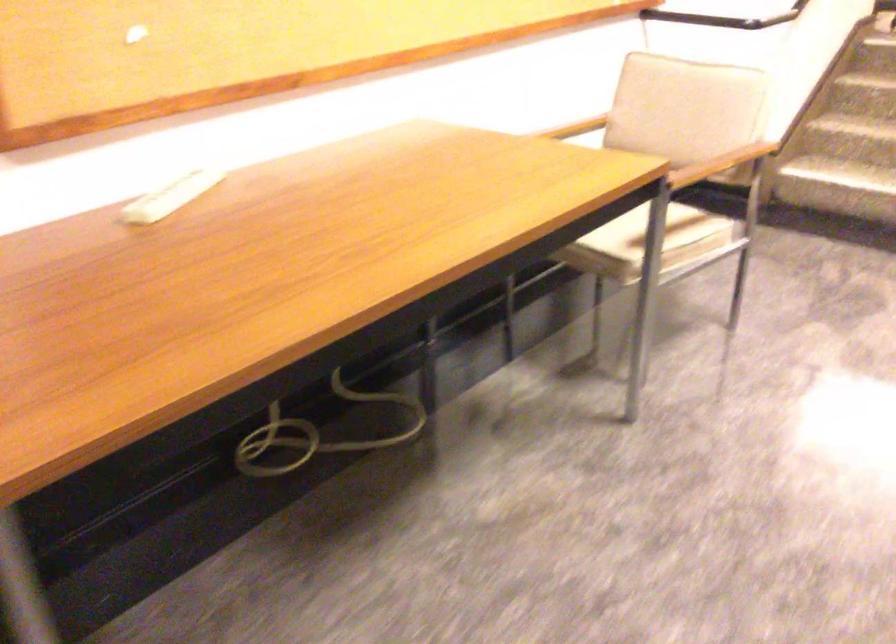
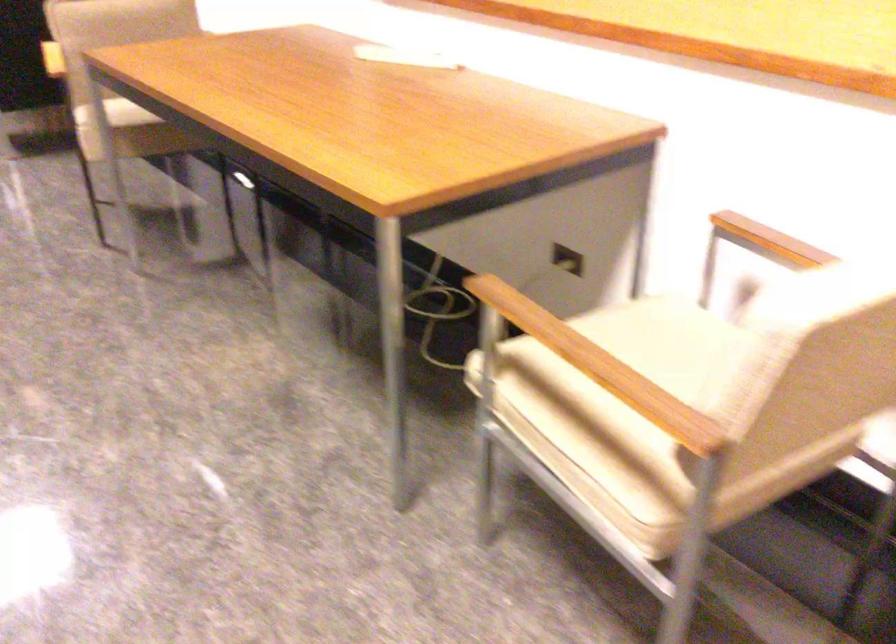
In the second image, find the point that corresponds to point (729, 158) in the first image.

(599, 366)